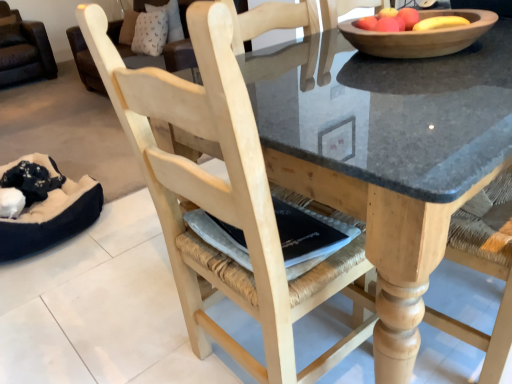
Question: Is natural wood table at center wider or thinner than natural wood chair at center?

Choices:
 (A) wide
 (B) thin

Answer: (A)

Question: Considering the positions of point (376, 236) and point (207, 21), is point (376, 236) closer or farther from the camera than point (207, 21)?

Choices:
 (A) farther
 (B) closer

Answer: (A)

Question: Which object is positioned farthest from the natural wood table at center?

Choices:
 (A) natural wood chair at center
 (B) wooden bowl at upper center
 (C) black plush bean bag at lower left

Answer: (C)

Question: Estimate the real-world distances between objects in this image. Which object is closer to the natural wood chair at center?

Choices:
 (A) natural wood table at center
 (B) black plush bean bag at lower left
 (C) wooden bowl at upper center

Answer: (A)